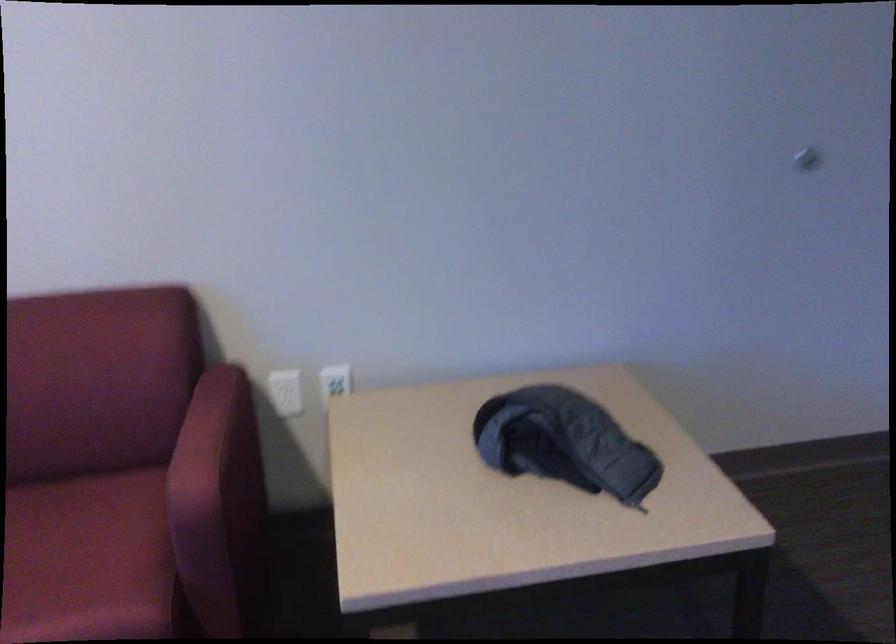
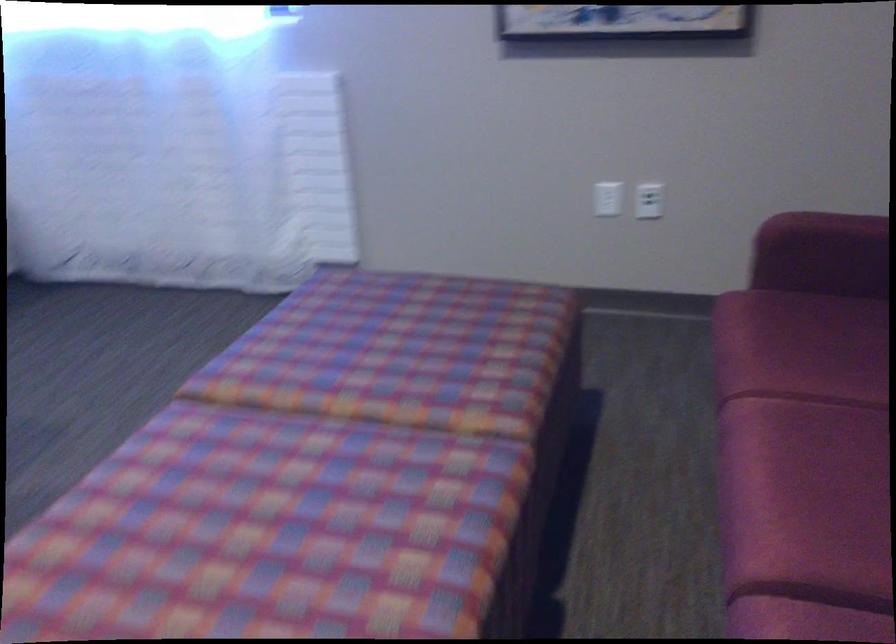
First-person continuous shooting, in which direction is the camera rotating?

The rotation direction of the camera is left-down.